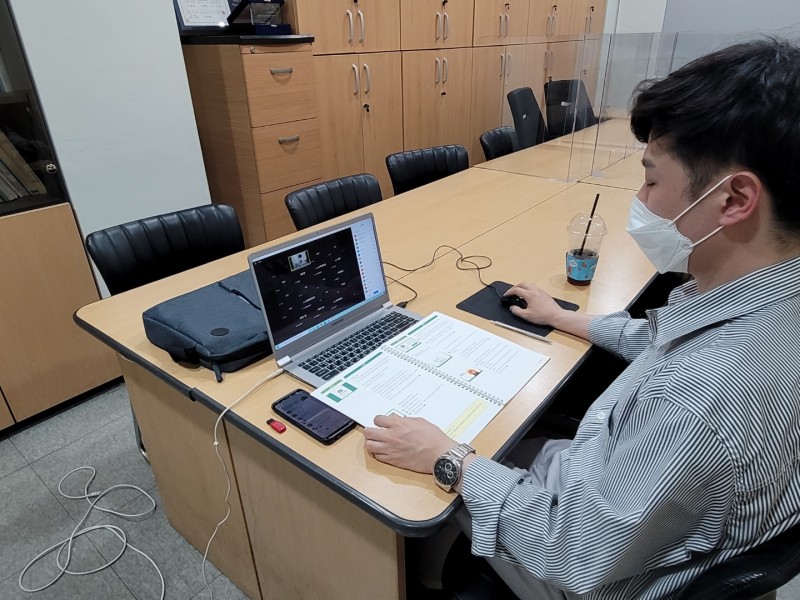
At what (x,y) coordinates should I click in order to perform the action: click on 1 clear plastic cup. Please return your answer as a coordinate pair (x, y). The image size is (800, 600). Looking at the image, I should click on (577, 263).